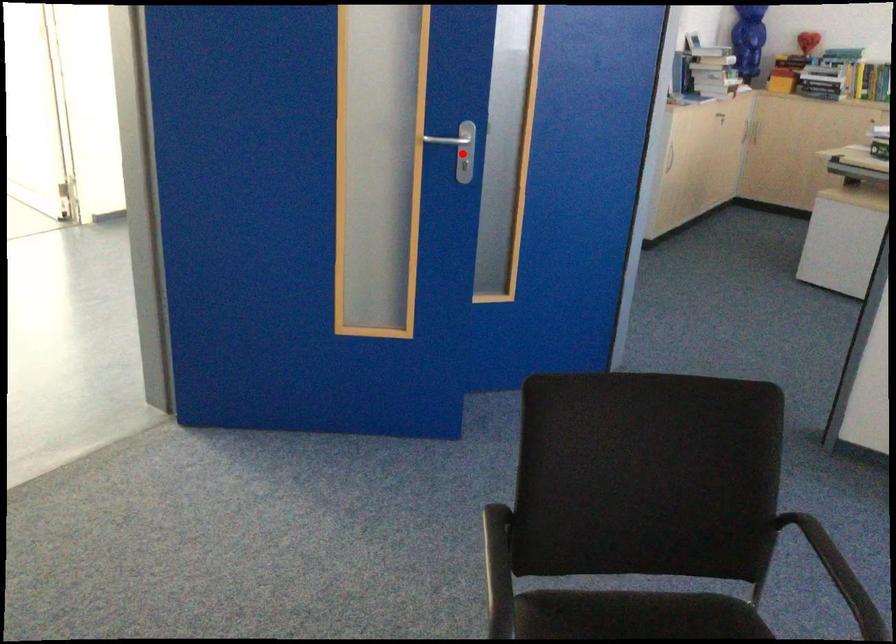
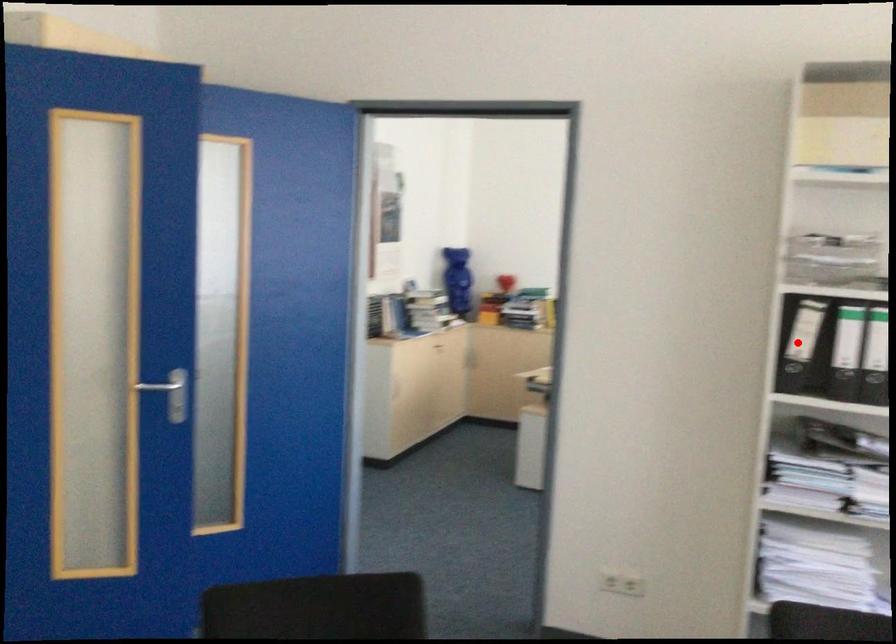
I am providing you with two images of the same scene from different viewpoints. A red point is marked on the first image and another point is marked on the second image. Is the red point in image1 aligned with the point shown in image2?

No